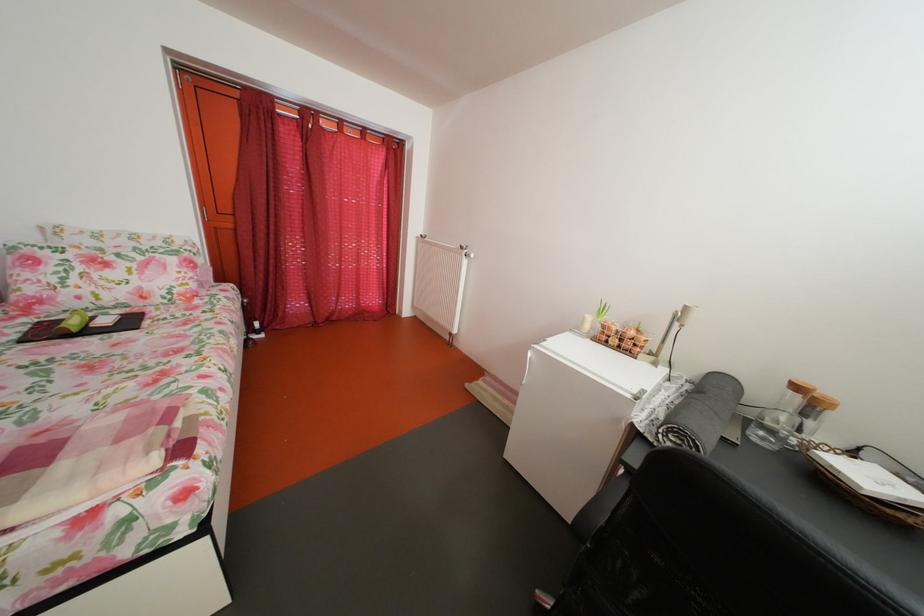
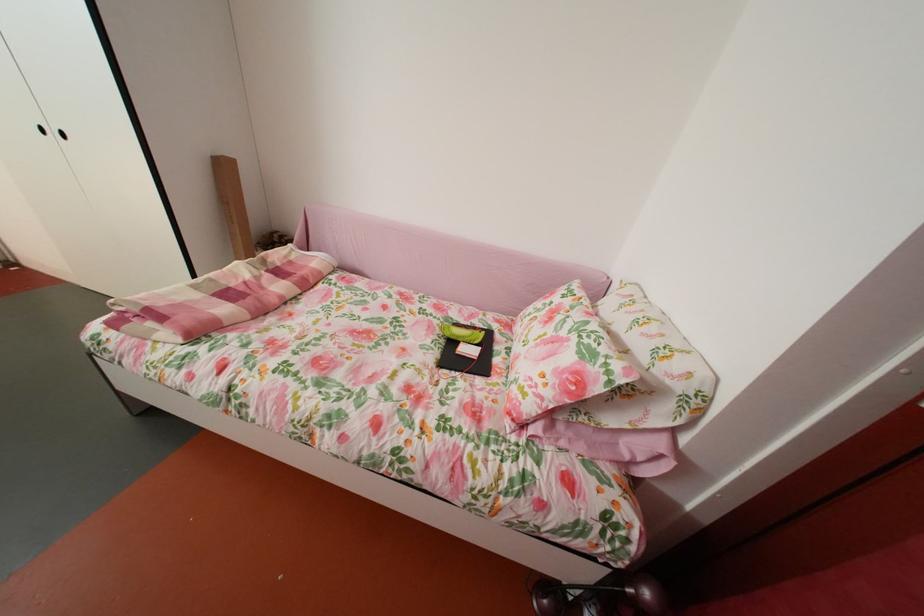
Find the pixel in the second image that matches (x=27, y=342) in the first image.

(473, 328)